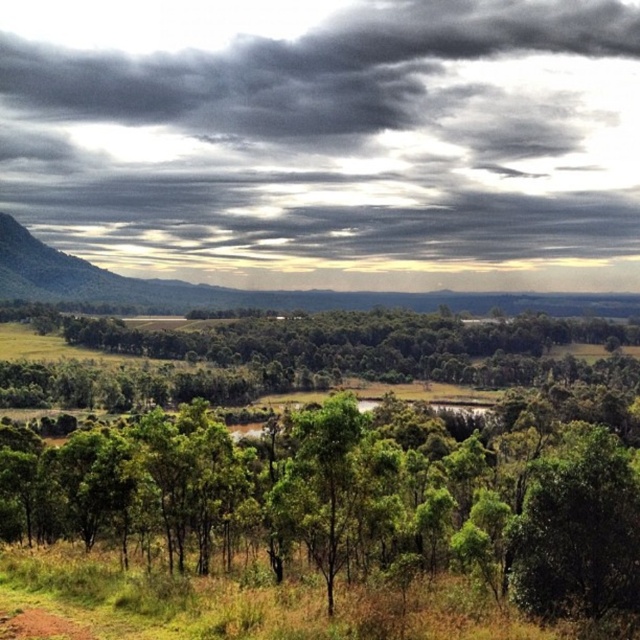
Question: Is dark gray cloud at upper center smaller than green leafy trees at center?

Choices:
 (A) no
 (B) yes

Answer: (A)

Question: Among these points, which one is nearest to the camera?

Choices:
 (A) 321,563
 (B) 140,40

Answer: (A)

Question: Is dark gray cloud at upper center positioned behind green leafy trees at center?

Choices:
 (A) yes
 (B) no

Answer: (A)

Question: Is dark gray cloud at upper center positioned in front of green leafy trees at center?

Choices:
 (A) yes
 (B) no

Answer: (B)